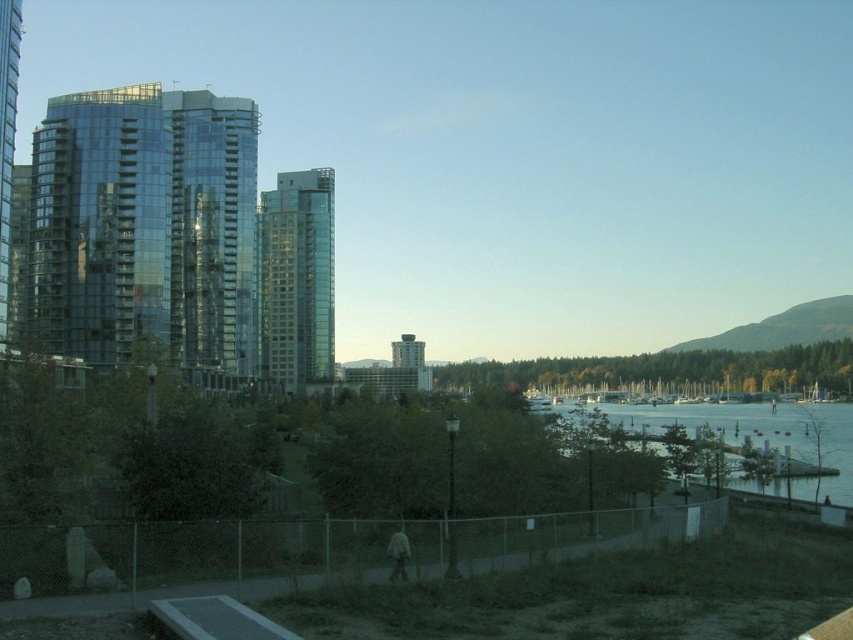
Question: Which point is closer to the camera?

Choices:
 (A) (410, 380)
 (B) (125, 304)

Answer: (B)

Question: Is shiny glass building at left bigger than glassy reflective building at center?

Choices:
 (A) no
 (B) yes

Answer: (B)

Question: Which object is closer to the camera taking this photo?

Choices:
 (A) shiny glass building at left
 (B) matte gray tower at center

Answer: (A)

Question: Does glassy reflective building at center appear on the right side of clear water at lower right?

Choices:
 (A) yes
 (B) no

Answer: (B)

Question: Among these points, which one is nearest to the camera?

Choices:
 (A) (409, 371)
 (B) (84, 128)

Answer: (B)

Question: Can you confirm if shiny glass building at left is wider than glassy reflective building at center?

Choices:
 (A) no
 (B) yes

Answer: (B)